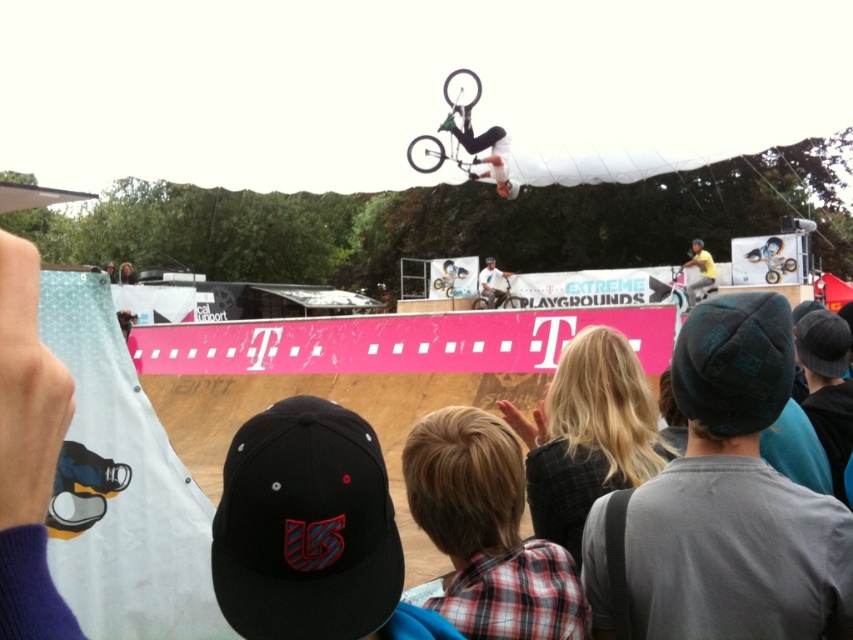
You are a photographer at the BMX event and want to capture both the black fabric cap at lower center and the black knit cap at upper right in a single shot. Can you position yourself so that neither cap is blocking the other in the photo?

The black fabric cap at lower center is in front of the black knit cap at upper right. To ensure neither blocks the other, position yourself to the side where both are visible without overlap.

You are a photographer at the BMX event and need to capture a photo that includes both the black fabric cap at lower center and the black knit cap at upper right. Which cap should you adjust your camera angle to focus on first if you want to ensure both are in frame without moving the camera?

The black fabric cap at lower center has a lesser height compared to the black knit cap at upper right. Therefore, you should focus on the black fabric cap at lower center first to ensure it is included in the frame before the taller black knit cap at upper right might block it.

What object is located at the coordinates point (311, 531) in the scene?

The point (311, 531) indicates the black fabric cap at lower center.